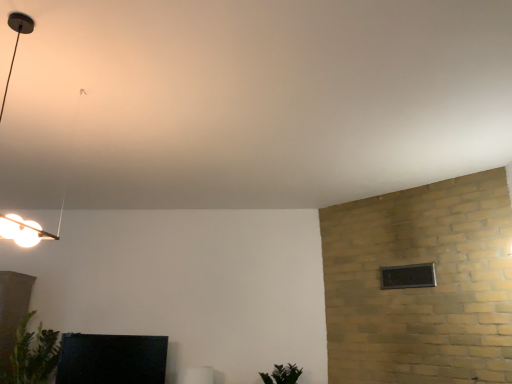
Question: From the image's perspective, is green matte plant at lower center, which ranks as the second plant in left-to-right order, located above white glossy frame at lower center, the 2th furniture in the left-to-right sequence?

Choices:
 (A) no
 (B) yes

Answer: (B)

Question: From a real-world perspective, does green matte plant at lower center, the first plant when ordered from right to left, sit lower than white glossy frame at lower center, the 2th furniture in the left-to-right sequence?

Choices:
 (A) no
 (B) yes

Answer: (A)

Question: Is the position of green matte plant at lower center, which ranks as the second plant in left-to-right order, less distant than that of white glossy frame at lower center, the 2th furniture in the left-to-right sequence?

Choices:
 (A) no
 (B) yes

Answer: (B)

Question: Is green matte plant at lower center, the first plant when ordered from right to left, wider than white glossy frame at lower center, arranged as the 1th furniture when viewed from the right?

Choices:
 (A) yes
 (B) no

Answer: (A)

Question: From the image's perspective, would you say green matte plant at lower center, which ranks as the second plant in left-to-right order, is shown under white glossy frame at lower center, the 2th furniture in the left-to-right sequence?

Choices:
 (A) yes
 (B) no

Answer: (B)

Question: Is green matte plant at lower center, which ranks as the second plant in left-to-right order, smaller than white glossy frame at lower center, arranged as the 1th furniture when viewed from the right?

Choices:
 (A) yes
 (B) no

Answer: (B)

Question: From a real-world perspective, is matte black lamp at upper left below green leafy plant at lower left, positioned as the 2th plant in right-to-left order?

Choices:
 (A) yes
 (B) no

Answer: (B)

Question: Can you confirm if matte black lamp at upper left is taller than green leafy plant at lower left, acting as the first plant starting from the left?

Choices:
 (A) no
 (B) yes

Answer: (B)

Question: Does matte black lamp at upper left have a greater width compared to green leafy plant at lower left, positioned as the 2th plant in right-to-left order?

Choices:
 (A) no
 (B) yes

Answer: (B)

Question: Is matte black lamp at upper left next to green leafy plant at lower left, acting as the first plant starting from the left?

Choices:
 (A) yes
 (B) no

Answer: (B)

Question: Is matte black lamp at upper left shorter than green leafy plant at lower left, positioned as the 2th plant in right-to-left order?

Choices:
 (A) yes
 (B) no

Answer: (B)

Question: Considering the relative sizes of matte black lamp at upper left and green leafy plant at lower left, acting as the first plant starting from the left, in the image provided, is matte black lamp at upper left smaller than green leafy plant at lower left, acting as the first plant starting from the left,?

Choices:
 (A) no
 (B) yes

Answer: (A)

Question: Does green leafy plant at lower left, acting as the first plant starting from the left, have a greater width compared to matte black tv at lower left, the 2th furniture from the right?

Choices:
 (A) no
 (B) yes

Answer: (B)